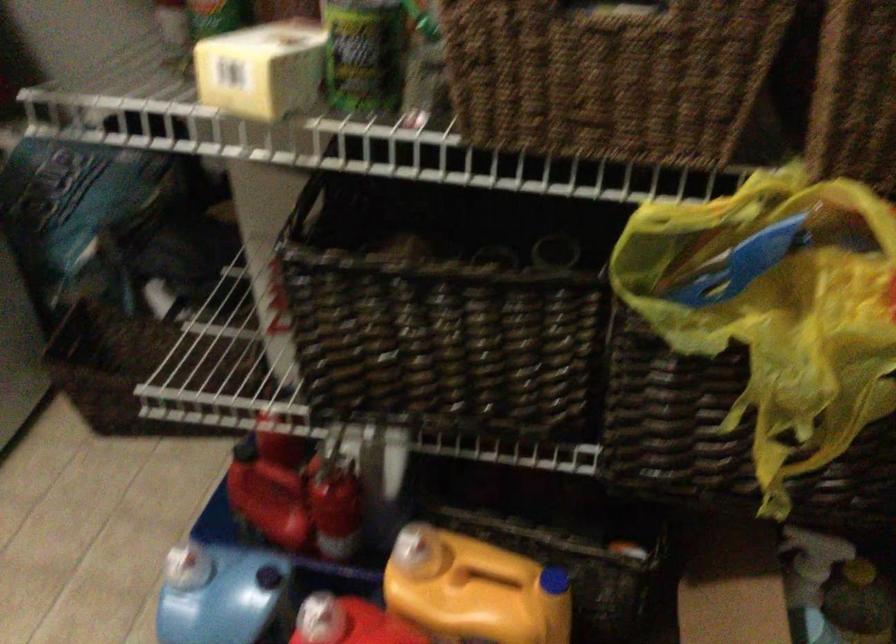
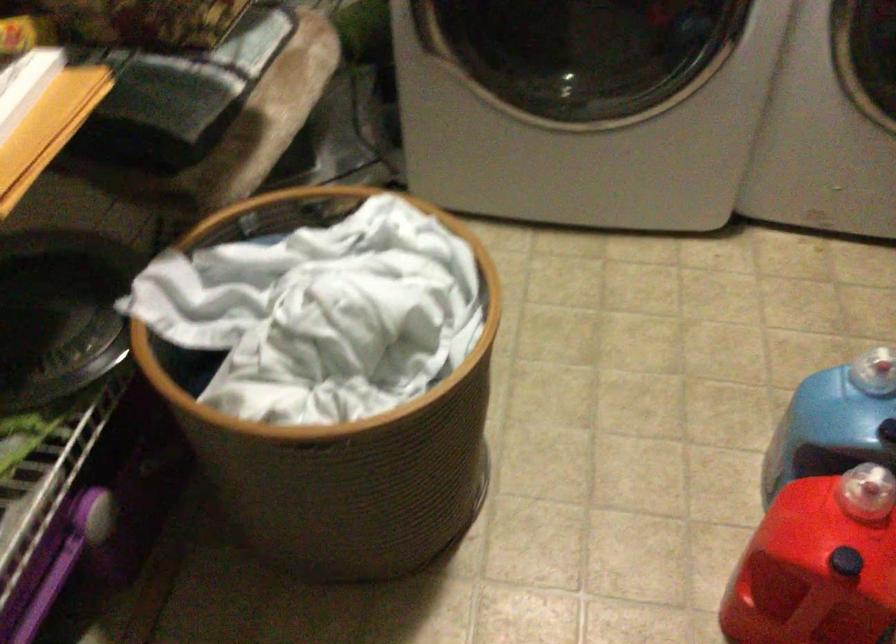
The point at (182, 567) is marked in the first image. Where is the corresponding point in the second image?

(872, 373)